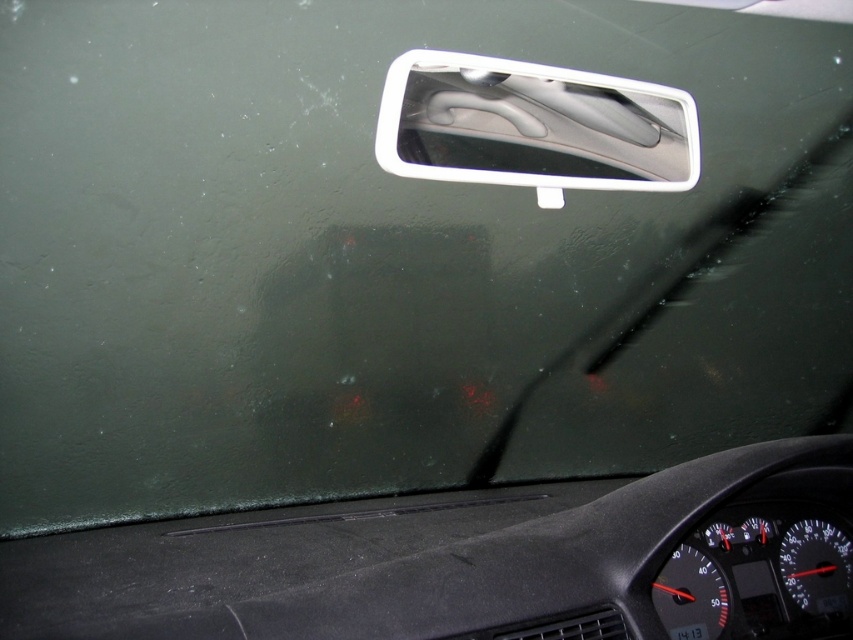
Question: Observing the image, what is the correct spatial positioning of white plastic car mirror at upper center in reference to white plastic license plate at center?

Choices:
 (A) right
 (B) left

Answer: (B)

Question: Which point is closer to the camera?

Choices:
 (A) white plastic car mirror at upper center
 (B) white plastic license plate at center

Answer: (B)

Question: Among these objects, which one is nearest to the camera?

Choices:
 (A) white plastic car mirror at upper center
 (B) white plastic license plate at center

Answer: (B)

Question: Which object appears closest to the camera in this image?

Choices:
 (A) white plastic license plate at center
 (B) white plastic car mirror at upper center

Answer: (A)

Question: Can you confirm if white plastic car mirror at upper center is bigger than white plastic license plate at center?

Choices:
 (A) no
 (B) yes

Answer: (B)

Question: Is white plastic car mirror at upper center further to camera compared to white plastic license plate at center?

Choices:
 (A) no
 (B) yes

Answer: (B)